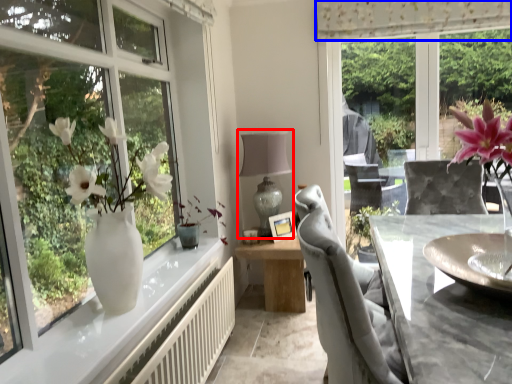
Question: Among these objects, which one is farthest to the camera, table lamp (highlighted by a red box) or curtain (highlighted by a blue box)?

Choices:
 (A) table lamp
 (B) curtain

Answer: (A)